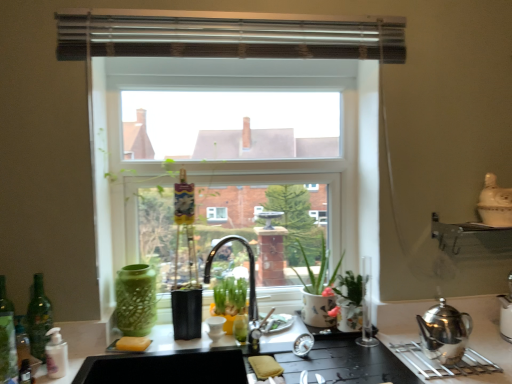
Question: Is polished stainless steel kettle at lower right at the left side of green glass bottle at left, the 3th bottle positioned from the right?

Choices:
 (A) yes
 (B) no

Answer: (B)

Question: Does polished stainless steel kettle at lower right come in front of green glass bottle at left, arranged as the 1th bottle when viewed from the left?

Choices:
 (A) no
 (B) yes

Answer: (B)

Question: Does polished stainless steel kettle at lower right have a greater width compared to green glass bottle at left, the 3th bottle positioned from the right?

Choices:
 (A) yes
 (B) no

Answer: (A)

Question: From the image's perspective, is polished stainless steel kettle at lower right on top of green glass bottle at left, the 3th bottle positioned from the right?

Choices:
 (A) yes
 (B) no

Answer: (B)

Question: Is polished stainless steel kettle at lower right with green glass bottle at left, the 3th bottle positioned from the right?

Choices:
 (A) yes
 (B) no

Answer: (B)

Question: From a real-world perspective, is polished stainless steel kettle at lower right positioned under green glass bottle at left, the 3th bottle positioned from the right, based on gravity?

Choices:
 (A) yes
 (B) no

Answer: (A)

Question: Can you confirm if white ceramic pot at center is shorter than polished stainless steel kettle at lower right?

Choices:
 (A) yes
 (B) no

Answer: (B)

Question: Is polished stainless steel kettle at lower right located within white ceramic pot at center?

Choices:
 (A) no
 (B) yes

Answer: (A)

Question: Is white ceramic pot at center thinner than polished stainless steel kettle at lower right?

Choices:
 (A) no
 (B) yes

Answer: (A)

Question: From the image's perspective, does white ceramic pot at center appear higher than polished stainless steel kettle at lower right?

Choices:
 (A) yes
 (B) no

Answer: (A)

Question: Does white ceramic pot at center appear on the left side of polished stainless steel kettle at lower right?

Choices:
 (A) yes
 (B) no

Answer: (A)

Question: Considering the relative sizes of white ceramic pot at center and polished stainless steel kettle at lower right in the image provided, is white ceramic pot at center smaller than polished stainless steel kettle at lower right?

Choices:
 (A) no
 (B) yes

Answer: (A)

Question: Is white matte bottle at lower left, the 3th bottle viewed from the left, in contact with clear glass window at center?

Choices:
 (A) yes
 (B) no

Answer: (B)